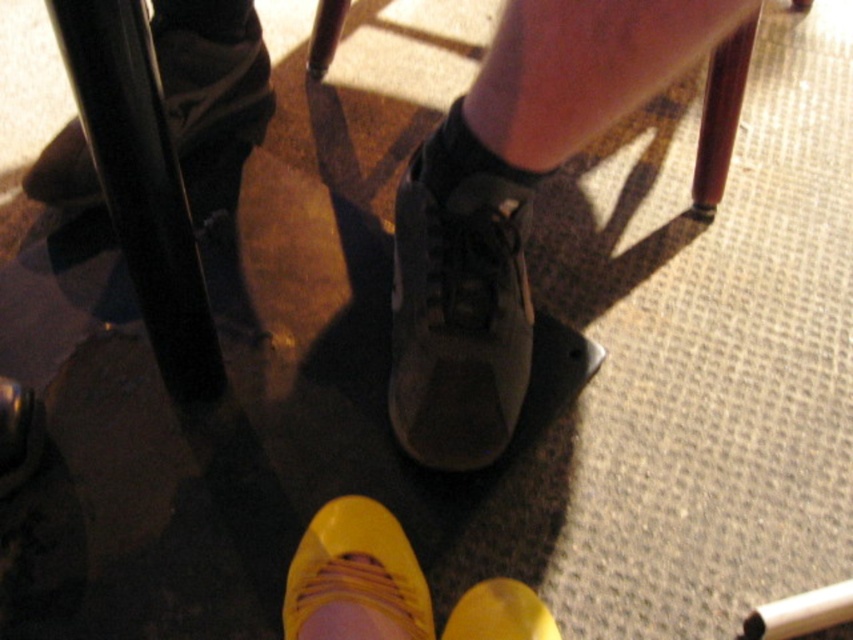
Question: Estimate the real-world distances between objects in this image. Which object is closer to the shiny black shoe at lower center?

Choices:
 (A) matte black shoe at lower left
 (B) matte black shoe at center

Answer: (A)

Question: Which is farther from the matte black sneaker at center?

Choices:
 (A) yellow suede shoe at lower center
 (B) matte black shoe at center

Answer: (A)

Question: Is matte black shoe at center wider than shiny black shoe at lower center?

Choices:
 (A) yes
 (B) no

Answer: (A)

Question: Which object appears farthest from the camera in this image?

Choices:
 (A) shiny black shoe at lower center
 (B) yellow suede shoe at lower center
 (C) matte black shoe at center

Answer: (A)

Question: Can you confirm if matte black shoe at lower left is thinner than yellow suede shoe at lower center?

Choices:
 (A) no
 (B) yes

Answer: (A)

Question: Is matte black shoe at center positioned at the back of matte black shoe at lower left?

Choices:
 (A) no
 (B) yes

Answer: (A)